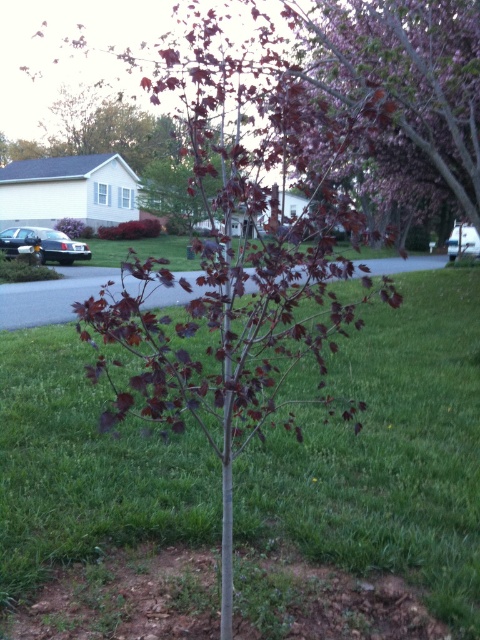
Does point (408, 288) come closer to viewer compared to point (468, 52)?

No.

Who is higher up, green grass at center or dark purple leafy tree at center?

dark purple leafy tree at center

Image resolution: width=480 pixels, height=640 pixels. Find the location of `green grass at center`. green grass at center is located at coordinates (388, 452).

Does green grass at center appear under purple glossy tree at upper right?

Yes.

Between point (10, 566) and point (428, 28), which one is positioned in front?

Point (10, 566) is in front.

This screenshot has width=480, height=640. What do you see at coordinates (388, 452) in the screenshot?
I see `green grass at center` at bounding box center [388, 452].

You are a GUI agent. You are given a task and a screenshot of the screen. Output one action in this format:
    pyautogui.click(x=<x>, y=<y>)
    Task: Click on the green grass at center
    
    Given the screenshot: What is the action you would take?
    pyautogui.click(x=388, y=452)

Is dark purple leafy tree at center behind purple glossy tree at upper right?

No, it is in front of purple glossy tree at upper right.

Is point (432, 8) positioned behind point (466, 22)?

No.

Is point (444, 106) less distant than point (420, 141)?

Yes, point (444, 106) is closer to viewer.

Identify the location of dark purple leafy tree at center. The height and width of the screenshot is (640, 480). (406, 74).